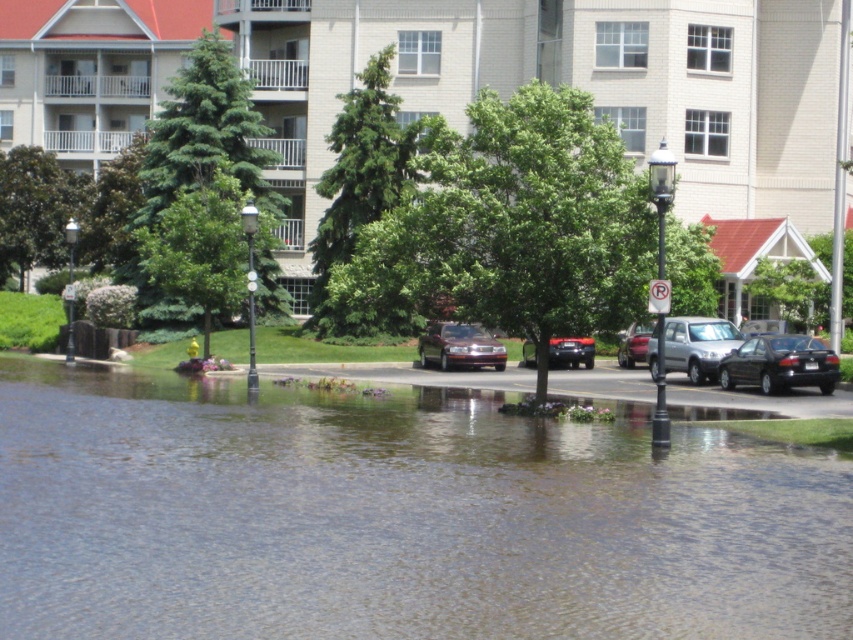
Can you confirm if satin silver suv at center is shorter than shiny silver sedan at center?

Incorrect, satin silver suv at center's height does not fall short of shiny silver sedan at center's.

Can you confirm if satin silver suv at center is positioned above shiny silver sedan at center?

Incorrect, satin silver suv at center is not positioned above shiny silver sedan at center.

Between point (714, 332) and point (619, 353), which one is positioned in front?

Positioned in front is point (714, 332).

Where is `satin silver suv at center`? satin silver suv at center is located at coordinates (691, 346).

Which is above, clear water at lower center or shiny maroon sedan at center?

shiny maroon sedan at center

Is point (111, 632) farther from camera compared to point (497, 364)?

That is False.

The height and width of the screenshot is (640, 853). Describe the element at coordinates (397, 516) in the screenshot. I see `clear water at lower center` at that location.

The height and width of the screenshot is (640, 853). Find the location of `clear water at lower center`. clear water at lower center is located at coordinates (397, 516).

Is point (718, 365) positioned after point (468, 324)?

No, (718, 365) is in front of (468, 324).

Where is `black matte sedan at lower right`? The width and height of the screenshot is (853, 640). black matte sedan at lower right is located at coordinates (780, 364).

Between point (746, 381) and point (448, 342), which one is positioned behind?

The point (448, 342) is behind.

The width and height of the screenshot is (853, 640). Find the location of `black matte sedan at lower right`. black matte sedan at lower right is located at coordinates (780, 364).